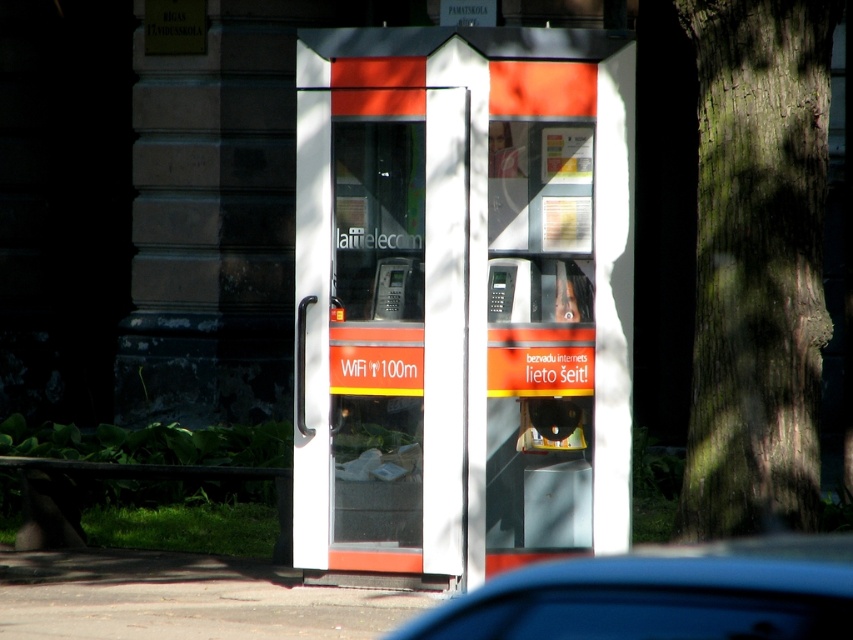
You are a pedestrian standing in front of the blue glossy car at lower center. You want to walk to the green rough bark tree at right. Which direction should you go?

The green rough bark tree at right is positioned on the right side of blue glossy car at lower center. To reach it, you should walk to the right.

You are a delivery person trying to find shade to wait for a package pickup. You notice the green rough bark tree at right and the matte plastic payphone at center. Which object would provide more shade based on their positions?

The green rough bark tree at right is positioned on the right side of the matte plastic payphone at center. Since trees typically cast larger and more consistent shade compared to phone booths, the tree would provide more shade for waiting.

You are a delivery person who needs to park your blue glossy car at lower center near the orange glossy phone booth at center. Can you park your car without it hitting the booth?

The orange glossy phone booth at center is taller than the blue glossy car at lower center. Since the booth is taller, the car can be parked near it without hitting the booth as height difference won